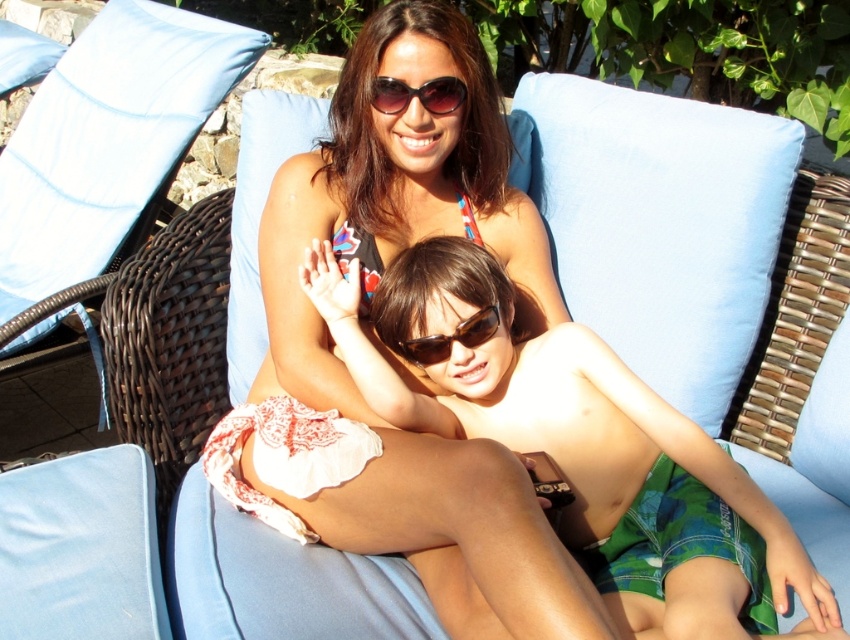
You are a photographer planning to take a photo of the matte white towel at center. The camera you are using has a focal length of 50mm. To ensure the towel is in focus, you need to know its position relative to the wicker chair with blue cushions. Based on the coordinates provided, is the towel closer to the front or back of the chair?

The matte white towel at center is located at point (x=542, y=401). Since the coordinates are both above 0.5, this indicates the towel is positioned towards the back of the wicker chair with blue cushions.

You are standing at the origin of the coordinate system in this image and want to throw a ball to hit both the point at (456, 154) and the point at (823, 621). Which point should you aim for first if you want to hit them in order from closest to farthest?

You should aim for point (823, 621) first since it is closer to you than point (456, 154), which is further away.